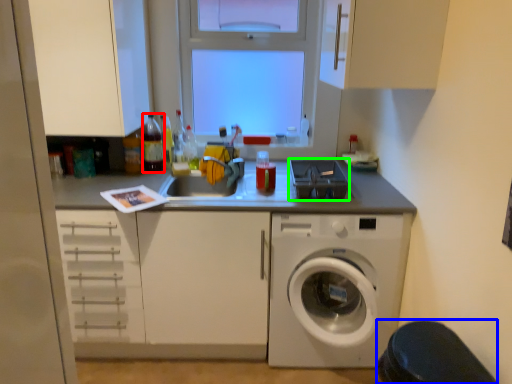
Question: Which is nearer to the bottle (highlighted by a red box)? step stool (highlighted by a blue box) or appliance (highlighted by a green box).

Choices:
 (A) step stool
 (B) appliance

Answer: (B)